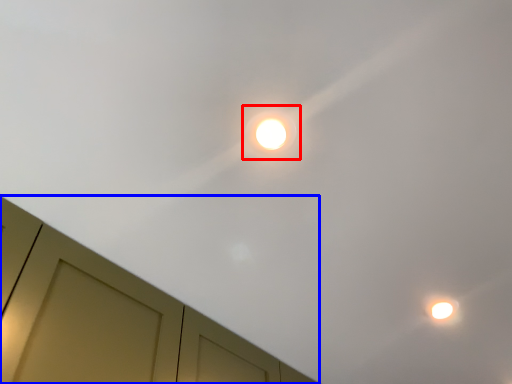
Question: Which of the following is the farthest to the observer, droplight (highlighted by a red box) or dresser (highlighted by a blue box)?

Choices:
 (A) droplight
 (B) dresser

Answer: (A)